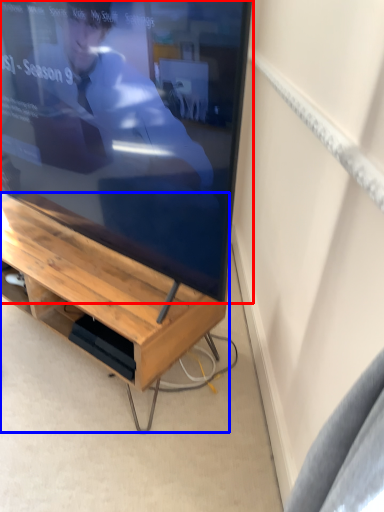
Question: Which of the following is the farthest to the observer, television (highlighted by a red box) or desk (highlighted by a blue box)?

Choices:
 (A) television
 (B) desk

Answer: (B)